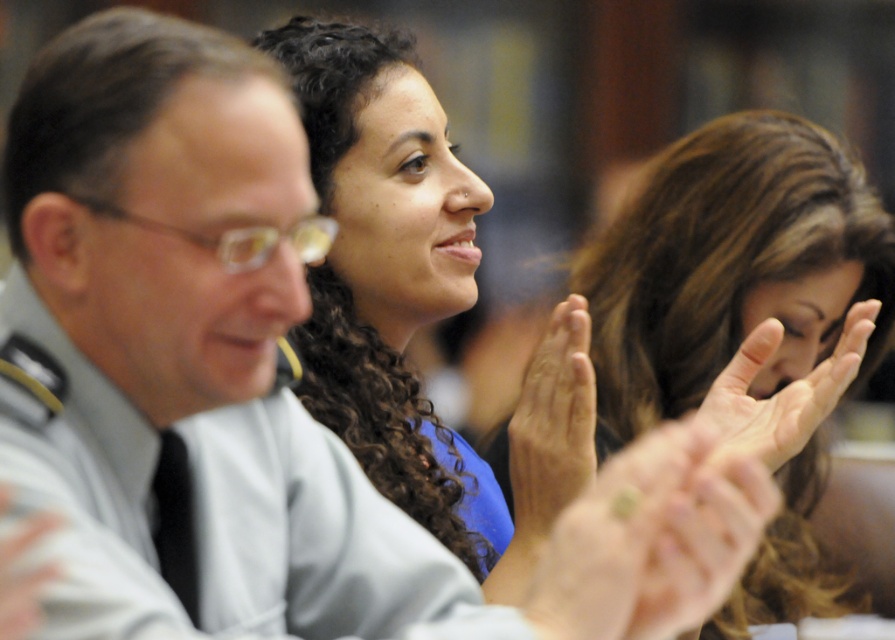
You are a photographer who just took this picture. You want to ensure that the green painted fingernail at center and the smooth skin hand at center are both visible in the final cropped image. Given their sizes, which object should you prioritize keeping in frame to ensure visibility?

The smooth skin hand at center should be prioritized because it occupies more space than the green painted fingernail at center, making it more likely to remain visible even after cropping.